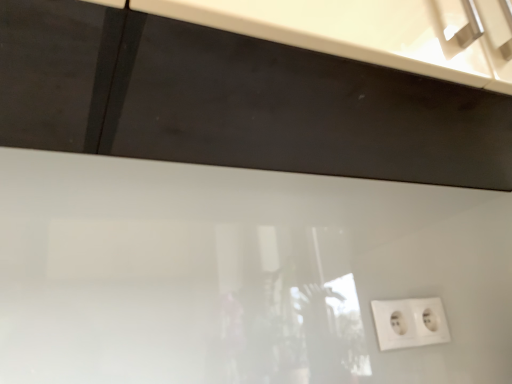
Question: Visually, is white plastic power plugs and sockets at lower right positioned to the left or to the right of white glossy cabinet at upper center?

Choices:
 (A) right
 (B) left

Answer: (A)

Question: Considering the positions of white plastic power plugs and sockets at lower right and white glossy cabinet at upper center in the image, is white plastic power plugs and sockets at lower right bigger or smaller than white glossy cabinet at upper center?

Choices:
 (A) small
 (B) big

Answer: (A)

Question: From a real-world perspective, is white plastic power plugs and sockets at lower right physically located above or below white glossy cabinet at upper center?

Choices:
 (A) above
 (B) below

Answer: (B)

Question: From their relative heights in the image, would you say white glossy cabinet at upper center is taller or shorter than white plastic power plugs and sockets at lower right?

Choices:
 (A) short
 (B) tall

Answer: (B)

Question: Is white glossy cabinet at upper center inside the boundaries of white plastic power plugs and sockets at lower right, or outside?

Choices:
 (A) inside
 (B) outside

Answer: (B)

Question: Considering the relative positions of white glossy cabinet at upper center and white plastic power plugs and sockets at lower right in the image provided, is white glossy cabinet at upper center to the left or to the right of white plastic power plugs and sockets at lower right?

Choices:
 (A) right
 (B) left

Answer: (B)

Question: In terms of size, does white glossy cabinet at upper center appear bigger or smaller than white plastic power plugs and sockets at lower right?

Choices:
 (A) small
 (B) big

Answer: (B)